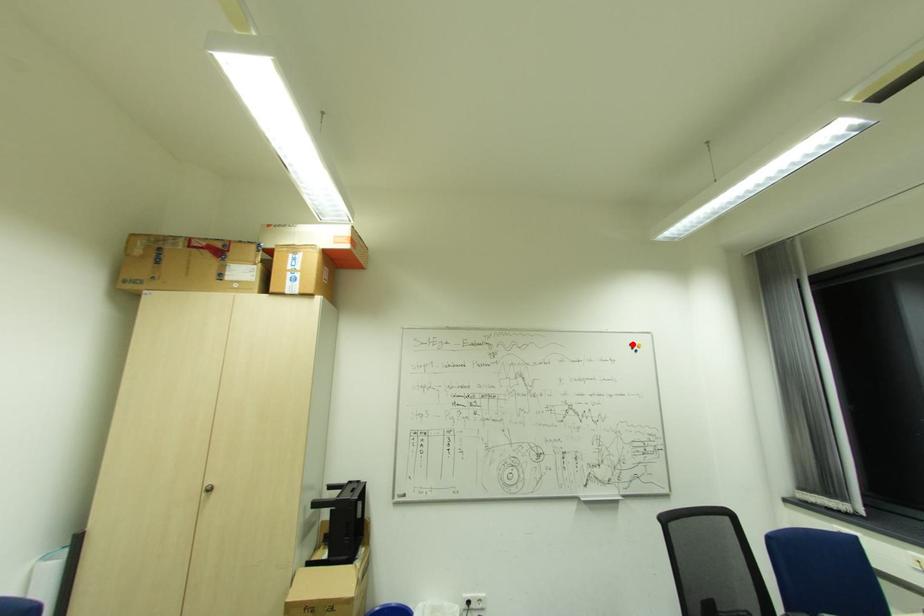
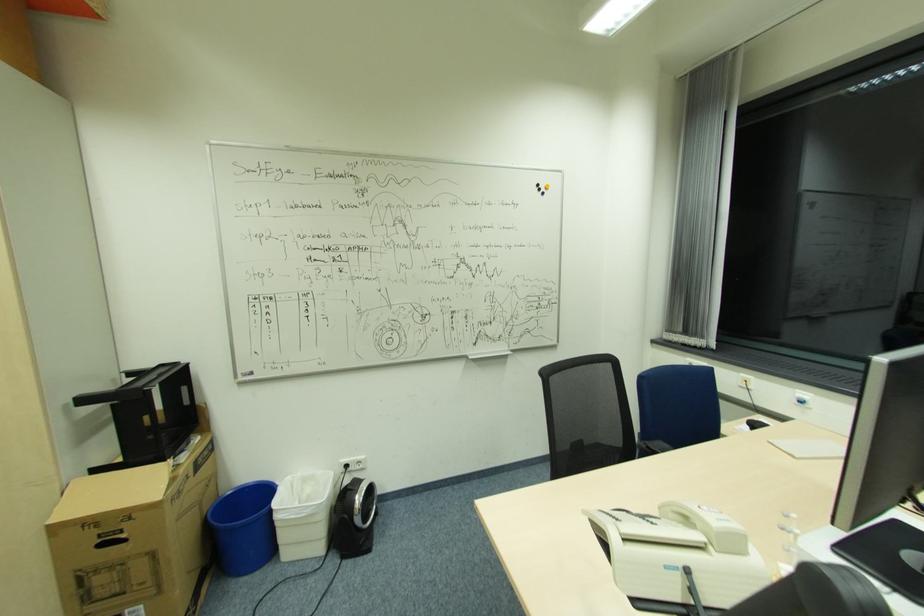
Locate, in the second image, the point that corresponds to the highlighted location in the first image.

(541, 185)